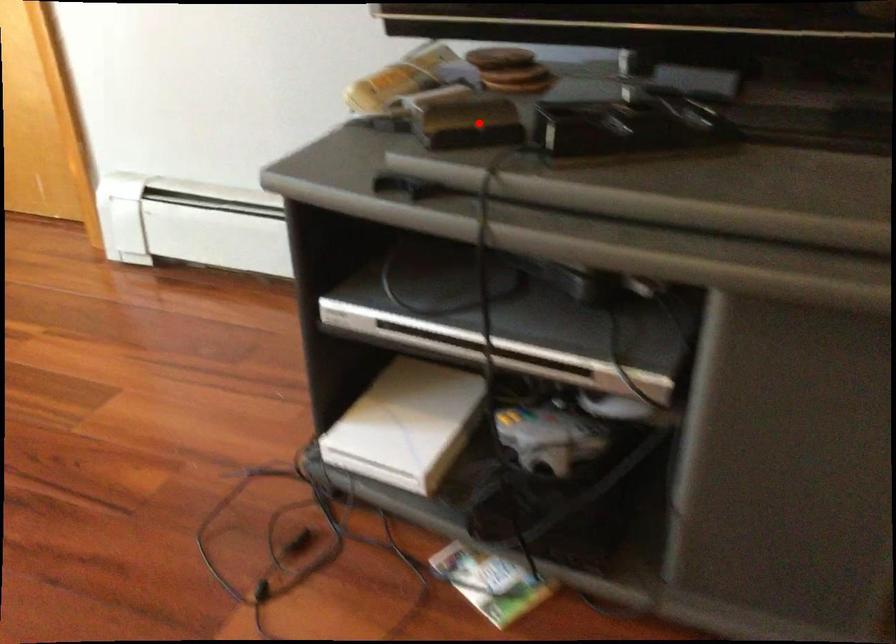
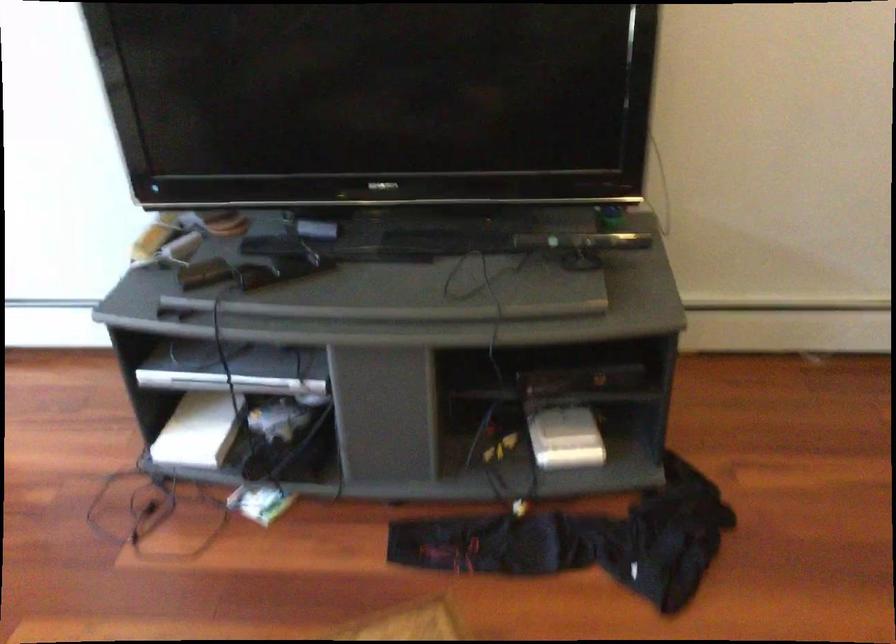
Question: I am providing you with two images of the same scene from different viewpoints. Image1 has a red point marked. In image2, the corresponding 3D location appears at what relative position? Reply with the corresponding letter.

Choices:
 (A) Closer
 (B) Farther

Answer: (B)